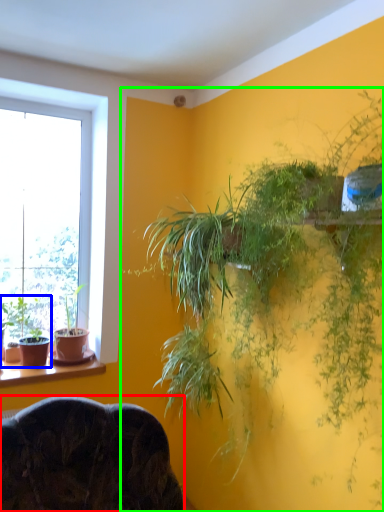
Question: Which object is the farthest from furniture (highlighted by a red box)? Choose among these: houseplant (highlighted by a blue box) or houseplant (highlighted by a green box).

Choices:
 (A) houseplant
 (B) houseplant

Answer: (B)